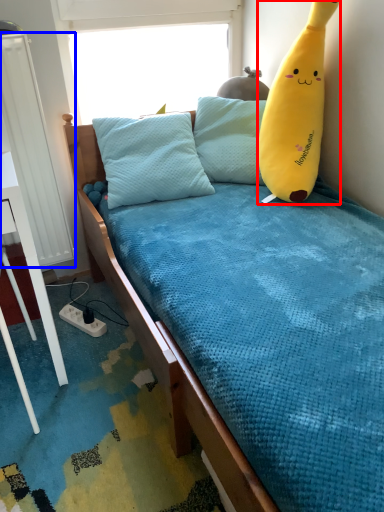
Question: Which object appears farthest to the camera in this image, banana (highlighted by a red box) or radiator (highlighted by a blue box)?

Choices:
 (A) banana
 (B) radiator

Answer: (B)